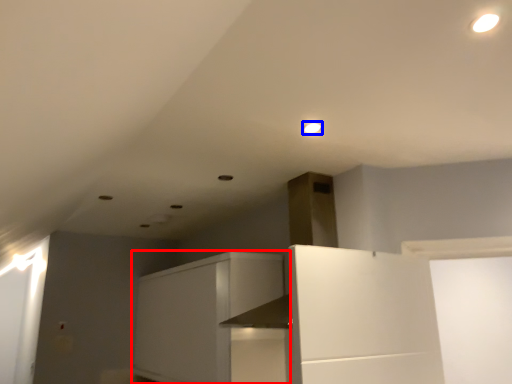
Question: Which object is closer to the camera taking this photo, cabinetry (highlighted by a red box) or lighting (highlighted by a blue box)?

Choices:
 (A) cabinetry
 (B) lighting

Answer: (B)